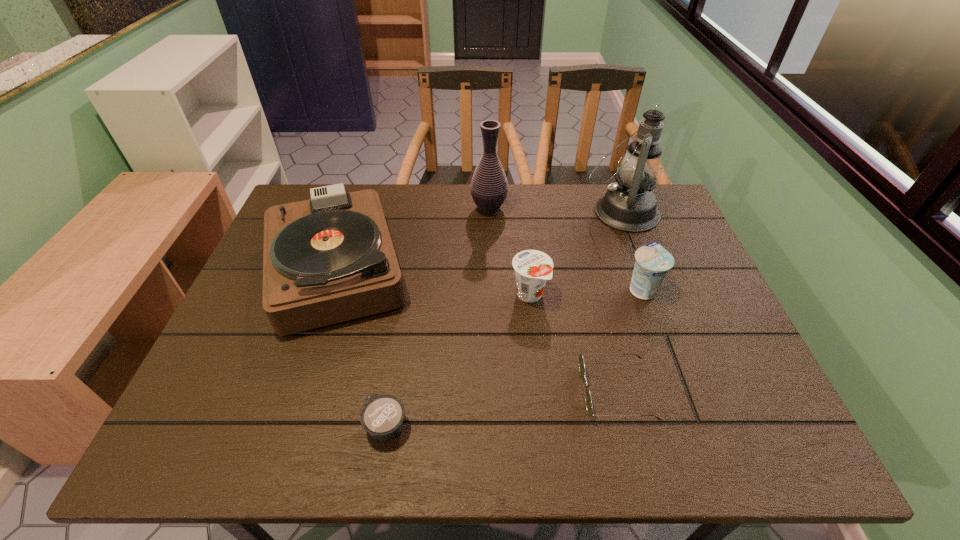
I want to click on vacant area between the sunglasses and the second yogurt from left to right, so click(x=573, y=342).

Find the location of `vacant space that's between the third tallest object and the leftmost yogurt`. vacant space that's between the third tallest object and the leftmost yogurt is located at coordinates (361, 347).

Identify the location of free space between the shortest yogurt and the second yogurt from right to left. (458, 360).

This screenshot has height=540, width=960. Find the location of `empty space that is in between the sunglasses and the nearest yogurt`. empty space that is in between the sunglasses and the nearest yogurt is located at coordinates (501, 409).

At what (x,y) coordinates should I click in order to perform the action: click on vacant area between the shortest yogurt and the tallest object. Please return your answer as a coordinate pair (x, y). Looking at the image, I should click on (504, 319).

The image size is (960, 540). I want to click on vacant space in between the leftmost yogurt and the oil lamp, so click(504, 319).

The width and height of the screenshot is (960, 540). What are the coordinates of `vacant area between the third tallest object and the rightmost yogurt` in the screenshot? It's located at (489, 278).

Locate an element on the screen. The image size is (960, 540). blank region between the sunglasses and the second tallest object is located at coordinates (553, 300).

Find the location of `vacant area that lies between the rightmost yogurt and the sunglasses`. vacant area that lies between the rightmost yogurt and the sunglasses is located at coordinates (629, 340).

Select which object is the second closest to the rightmost yogurt. Please provide its 2D coordinates. Your answer should be formatted as a tuple, i.e. [(x, y)], where the tuple contains the x and y coordinates of a point satisfying the conditions above.

[(629, 205)]